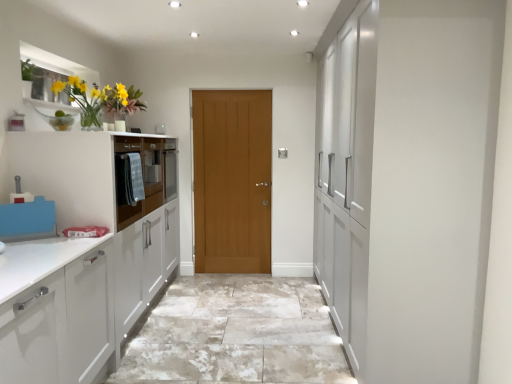
Locate an element on the screen. Image resolution: width=512 pixels, height=384 pixels. free region on the left part of light brown wooden door at center is located at coordinates (195, 280).